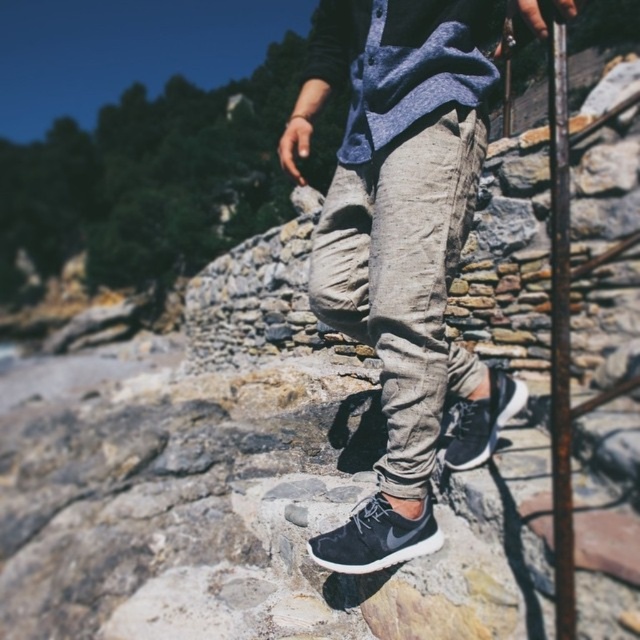
Question: Which point is closer to the camera?

Choices:
 (A) (317, 81)
 (B) (310, 550)
 (C) (497, 408)

Answer: (B)

Question: Which point is farther to the camera?

Choices:
 (A) (518, 394)
 (B) (307, 115)
 (C) (332, 570)

Answer: (B)

Question: Can you confirm if gray cotton pants at center is smaller than dark gray suede sneaker at lower center?

Choices:
 (A) no
 (B) yes

Answer: (A)

Question: Does gray cotton pants at center appear over matte black sneaker at lower center?

Choices:
 (A) yes
 (B) no

Answer: (A)

Question: Which is farther from the matte black sneaker at lower center?

Choices:
 (A) dark gray suede sneaker at lower center
 (B) gray cotton pants at center

Answer: (A)

Question: Can you confirm if dark gray suede sneaker at lower center is wider than matte black sneaker at lower center?

Choices:
 (A) yes
 (B) no

Answer: (A)